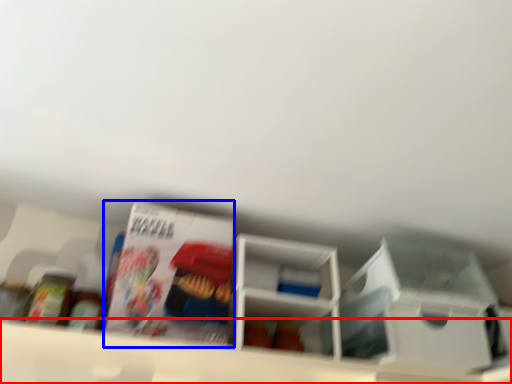
Question: Which of the following is the closest to the observer, shelf (highlighted by a red box) or magazine (highlighted by a blue box)?

Choices:
 (A) shelf
 (B) magazine

Answer: (A)